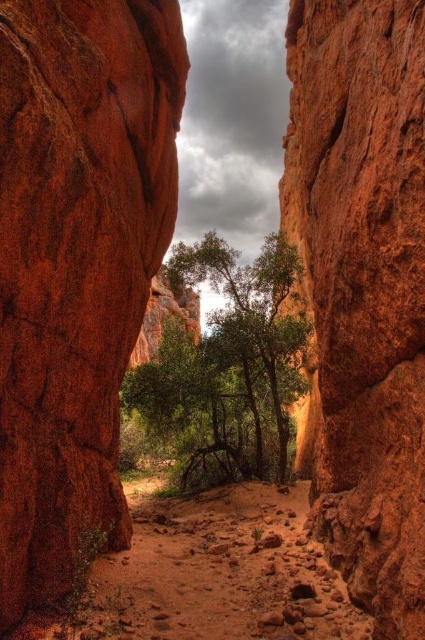
Question: Among these objects, which one is farthest from the camera?

Choices:
 (A) rustic sandstone rock at center
 (B) rustic sandstone cliff at center

Answer: (A)

Question: Is rustic sandstone rock at center to the right of dusty dirt path at center from the viewer's perspective?

Choices:
 (A) yes
 (B) no

Answer: (B)

Question: Which object appears farthest from the camera in this image?

Choices:
 (A) dusty dirt path at center
 (B) rustic sandstone cliff at center
 (C) green leafy tree at center

Answer: (C)

Question: Does rustic sandstone rock at center appear over rustic sandstone cliff at center?

Choices:
 (A) no
 (B) yes

Answer: (A)

Question: Does dusty dirt path at center have a lesser width compared to green leafy tree at center?

Choices:
 (A) yes
 (B) no

Answer: (A)

Question: Which point is closer to the camera taking this photo?

Choices:
 (A) (110, 508)
 (B) (226, 458)
 (C) (201, 632)
 (D) (331, 0)

Answer: (C)